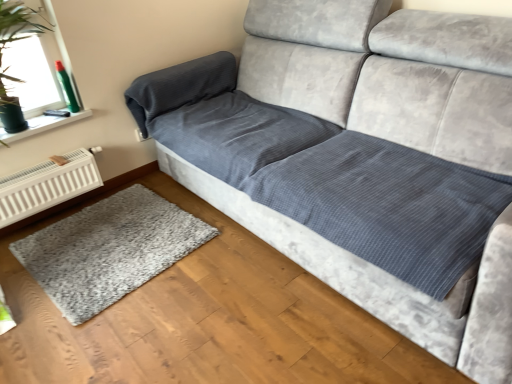
Identify the location of vacant space to the right of gray shaggy rug at lower left. The width and height of the screenshot is (512, 384). (234, 266).